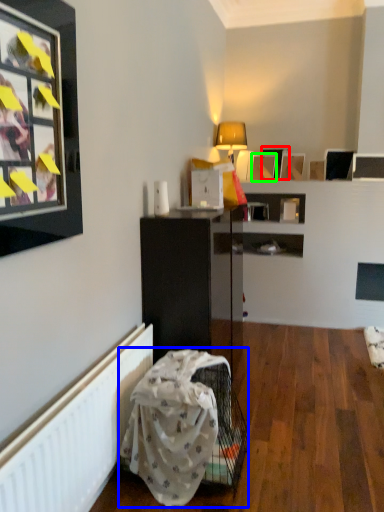
Question: Which is nearer to the picture frame (highlighted by a red box)? swivel chair (highlighted by a blue box) or picture frame (highlighted by a green box).

Choices:
 (A) swivel chair
 (B) picture frame

Answer: (B)